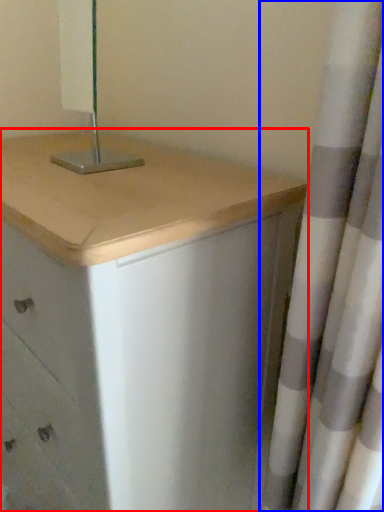
Question: Which object is further to the camera taking this photo, chest of drawers (highlighted by a red box) or curtain (highlighted by a blue box)?

Choices:
 (A) chest of drawers
 (B) curtain

Answer: (A)